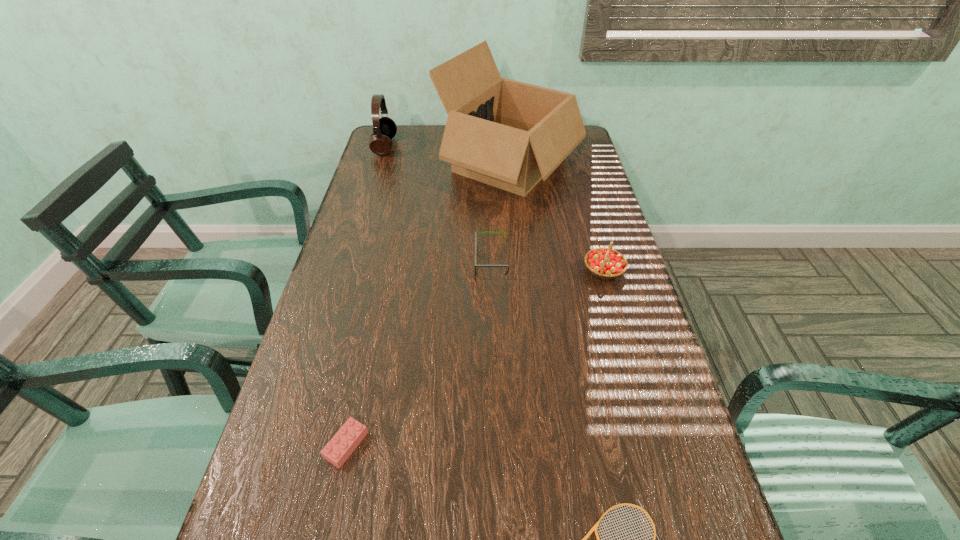
Image resolution: width=960 pixels, height=540 pixels. I want to click on vacant space located on the lens of the spectacles, so click(431, 261).

I want to click on blank space located 0.190m on the lens of the spectacles, so click(x=405, y=261).

Where is `vacant space situated 0.320m on the lens of the spectacles`? Image resolution: width=960 pixels, height=540 pixels. vacant space situated 0.320m on the lens of the spectacles is located at coordinates (357, 261).

The width and height of the screenshot is (960, 540). What are the coordinates of `vacant region located on the back of the second shortest object` in the screenshot? It's located at (370, 337).

I want to click on box at the far edge, so click(508, 134).

Image resolution: width=960 pixels, height=540 pixels. Find the location of `headset at the far edge`. headset at the far edge is located at coordinates (384, 128).

Find the location of a particular element. The height and width of the screenshot is (540, 960). headset present at the left edge is located at coordinates (384, 128).

In order to click on Lego at the left edge in this screenshot , I will do `click(344, 442)`.

At what (x,y) coordinates should I click in order to perform the action: click on box positioned at the right edge. Please return your answer as a coordinate pair (x, y). The image size is (960, 540). Looking at the image, I should click on (508, 134).

The width and height of the screenshot is (960, 540). What are the coordinates of `strawberry at the right edge` in the screenshot? It's located at (606, 263).